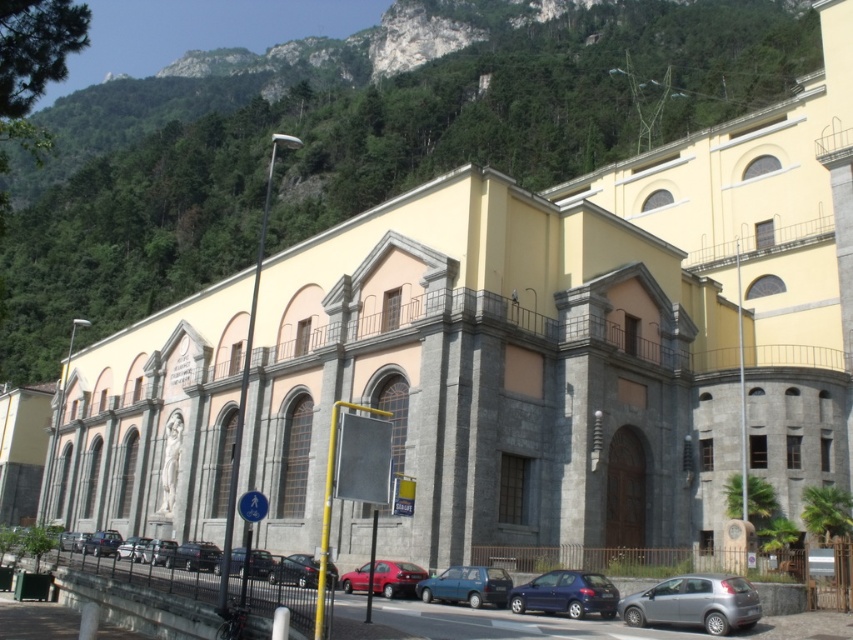
You are a pedestrian standing at the pedestrian crossing sign on the left side of the image. You want to cross the road to reach the building. Which car, the metallic blue sedan at center or the matte black car at lower center, is closer to the building?

The metallic blue sedan at center is closer to the building because it is positioned below the matte black car at lower center, indicating it is further away from the pedestrian crossing and thus nearer to the building.

You are a delivery person needing to park your van, which is 5 meters long, in the parking area. The parking spots here are 4.5 meters long. You see a metallic blue hatchback at center and a metallic silver car at center. Can you park your van between them without overlapping any vehicles?

The metallic blue hatchback at center is smaller than the metallic silver car at center, but both vehicles are parked in 4.5 meter spots. Since your van is 5 meters long, it won let you park between them without overlapping because the available space is shorter than your vehicle.

You are a delivery person standing at the pedestrian crossing sign on the left. You need to load a package into the trunk of the metallic blue sedan at center and the matte black car at lower center. Which car should you approach first to ensure you can reach it without moving any other vehicles?

You should approach the metallic blue sedan at center first because it is closer to you than the matte black car at lower center, so you can access it without needing to move other vehicles.